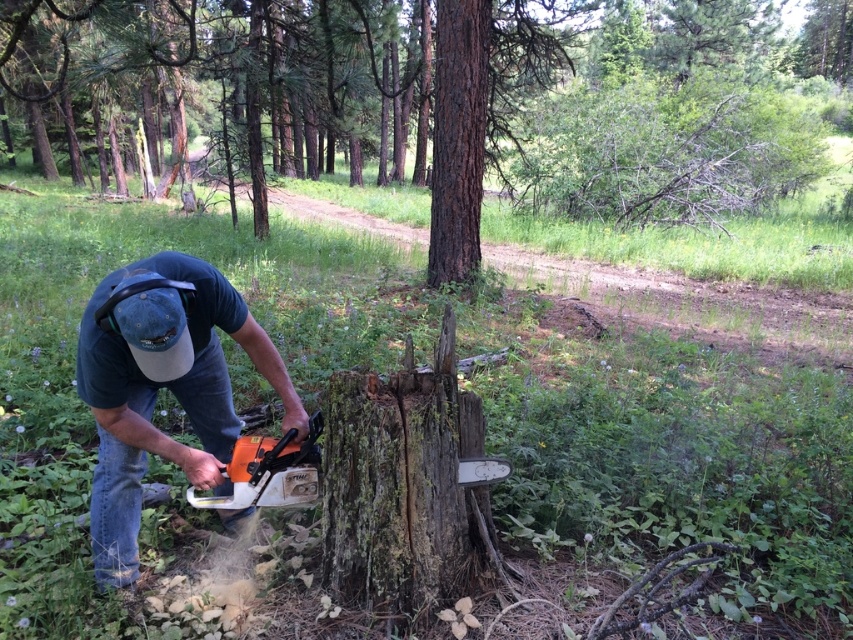
You are standing at the point with coordinates (434, 102) in the forest scene. What object is located exactly at this point?

The point at coordinates (434, 102) is exactly where the smooth bark tree stump at center is located.

You are a safety inspector checking the workspace. You see the orange plastic chainsaw at lower left and the brown rough bark tree trunk at center. Which object takes up more space in the scene?

The brown rough bark tree trunk at center occupies more space than the orange plastic chainsaw at lower left.

You are standing at the point labeled as point (152, 132) in the image. The viewer is 22.44 meters away from you. If you want to walk directly towards the viewer, which direction should you head?

Since the viewer is 22.44 meters away from the point (152, 132), you should walk directly towards the viewer from that point.